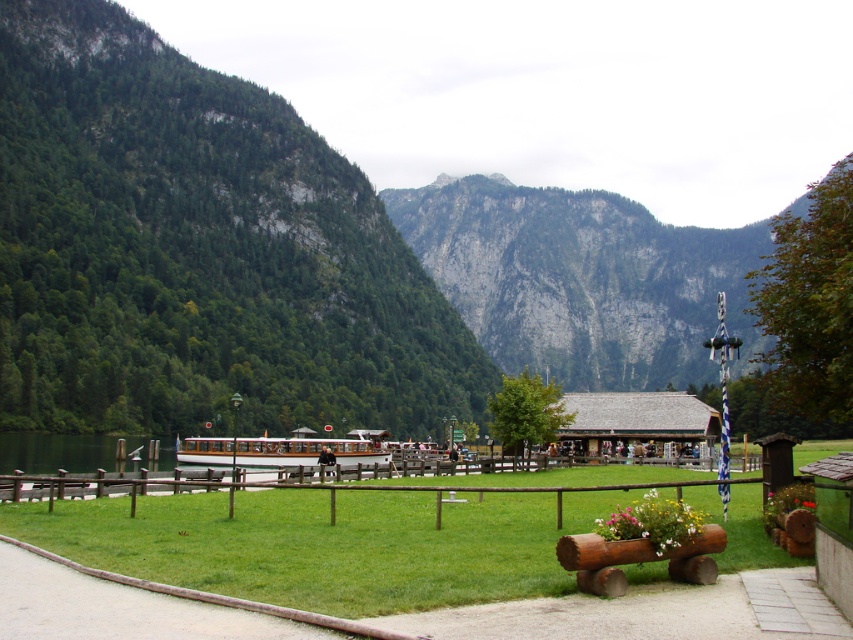
Question: Is green forested mountain at center to the right of clear water at dock left from the viewer's perspective?

Choices:
 (A) yes
 (B) no

Answer: (B)

Question: Which of the following is the closest to the observer?

Choices:
 (A) clear water at dock left
 (B) green grass at center
 (C) green rocky mountain at center
 (D) green forested mountain at center

Answer: (B)

Question: Can you confirm if green rocky mountain at center is positioned to the left of clear water at dock left?

Choices:
 (A) yes
 (B) no

Answer: (B)

Question: Among these objects, which one is farthest from the camera?

Choices:
 (A) concrete sidewalk at lower center
 (B) clear water at dock left

Answer: (B)

Question: Which of these objects is positioned closest to the green rocky mountain at center?

Choices:
 (A) clear water at dock left
 (B) wooden polished boat at center

Answer: (B)

Question: Is green grass at center thinner than wooden log bench at lower center?

Choices:
 (A) yes
 (B) no

Answer: (B)